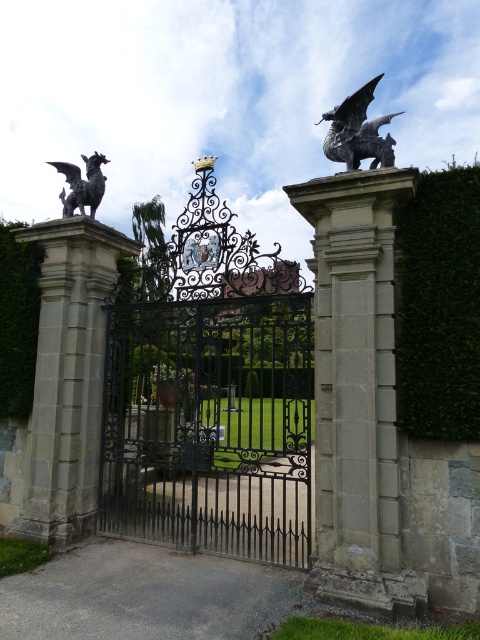
You are a gardener who needs to trim the green leafy hedge at left and the black polished stone gargoyle at left. If your shears have a reach of 1 meter, can you reach the hedge from the gargoyle without moving your position?

The distance between the green leafy hedge at left and the black polished stone gargoyle at left is 1.16 meters. Since your shears only reach 1 meter, you cannot trim the hedge from the gargoyle without moving closer.

You are holding a camera and want to take a photo of the green leafy hedge at right. If you are standing 5 meters away from the hedge, will you be able to capture the entire hedge in the frame without moving closer?

The green leafy hedge at right and camera are 5.01 meters apart from each other, so if you are standing 5 meters away, you are slightly closer than the required distance. Therefore, you can capture the entire hedge in the frame without moving closer.

You are a visitor approaching the entrance of a historic estate. You see the black wrought iron gate at center and the black polished stone gargoyle at left. Which object is closer to you as you approach the entrance?

The black wrought iron gate at center is closer to you because it is in front of the black polished stone gargoyle at left.